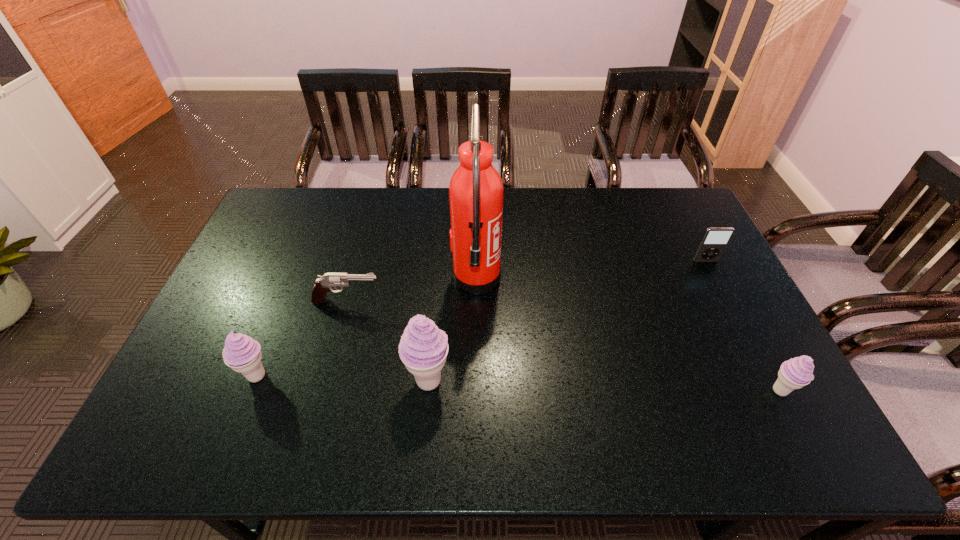
Find the location of `free location that satisfies the following two spatial constraints: 1. on the label side of the rightmost icecream; 2. on the right side of the tallest object`. free location that satisfies the following two spatial constraints: 1. on the label side of the rightmost icecream; 2. on the right side of the tallest object is located at coordinates (475, 390).

This screenshot has width=960, height=540. I want to click on free space that satisfies the following two spatial constraints: 1. at the muzzle of the second object from left to right; 2. on the back side of the shortest icecream, so click(x=323, y=390).

The height and width of the screenshot is (540, 960). Identify the location of free spot that satisfies the following two spatial constraints: 1. on the label side of the tallest object; 2. on the left side of the rightmost icecream. (475, 390).

At what (x,y) coordinates should I click in order to perform the action: click on free spot that satisfies the following two spatial constraints: 1. on the front side of the rightmost icecream; 2. on the right side of the leftmost icecream. Please return your answer as a coordinate pair (x, y). The height and width of the screenshot is (540, 960). Looking at the image, I should click on (252, 390).

Find the location of a particular element. Image resolution: width=960 pixels, height=540 pixels. free spot that satisfies the following two spatial constraints: 1. on the front-facing side of the iPod; 2. on the label side of the tallest object is located at coordinates (714, 279).

Identify the location of free spot that satisfies the following two spatial constraints: 1. at the muzzle of the fifth object from right to left; 2. on the right side of the second tallest object. coord(324,381).